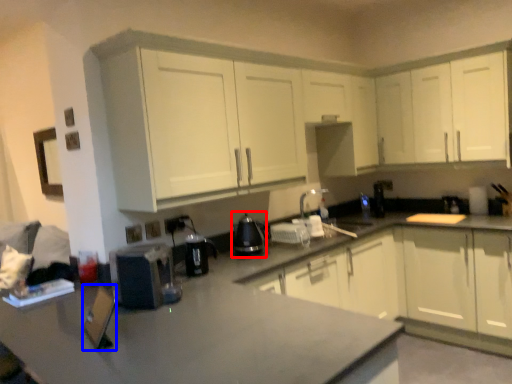
Question: Which object appears closest to the camera in this image, appliance (highlighted by a red box) or appliance (highlighted by a blue box)?

Choices:
 (A) appliance
 (B) appliance

Answer: (B)